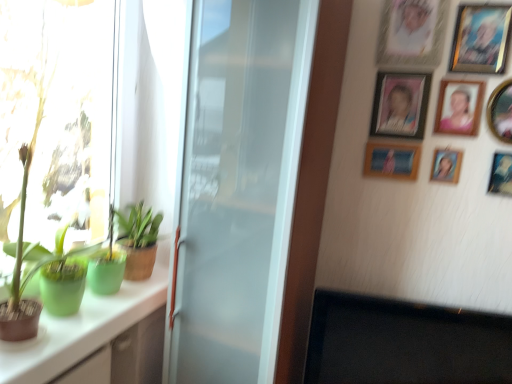
Identify the location of blank space above white glossy cabinet at left (from a real-world perspective). This screenshot has width=512, height=384. (88, 313).